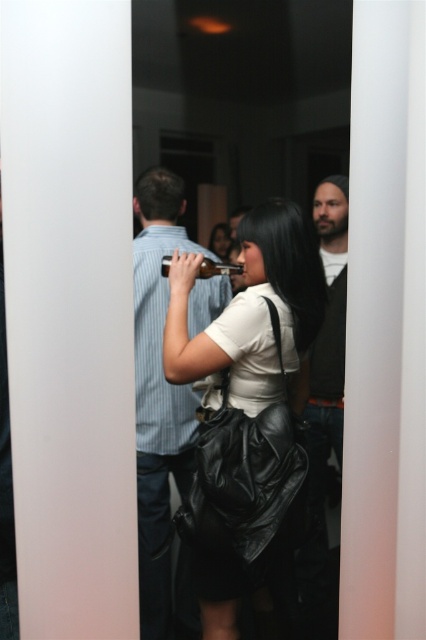
Question: Which object is farther from the camera taking this photo?

Choices:
 (A) dark brown leather jacket at right
 (B) blue striped shirt at center
 (C) matte black bag at center
 (D) matte black purse at center

Answer: (D)

Question: Is matte black bag at center above dark brown leather jacket at right?

Choices:
 (A) no
 (B) yes

Answer: (B)

Question: Among these points, which one is farthest from the camera?

Choices:
 (A) (333, 424)
 (B) (144, 470)
 (C) (261, 344)

Answer: (A)

Question: Is matte black bag at center further to the viewer compared to dark brown leather jacket at right?

Choices:
 (A) no
 (B) yes

Answer: (A)

Question: Which of the following is the farthest from the observer?

Choices:
 (A) (339, 198)
 (B) (232, 339)
 (C) (209, 246)

Answer: (C)

Question: Can you confirm if matte black bag at center is positioned to the right of matte black purse at center?

Choices:
 (A) no
 (B) yes

Answer: (B)